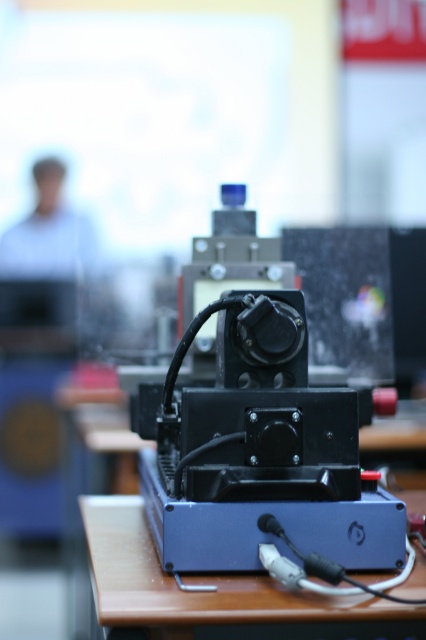
Is metallic black machine at center to the left of blue plastic table at center from the viewer's perspective?

In fact, metallic black machine at center is to the right of blue plastic table at center.

How distant is metallic black machine at center from blue plastic table at center?

They are 6.85 inches apart.

Identify the location of metallic black machine at center. (259, 449).

Where is `metallic black machine at center`? The height and width of the screenshot is (640, 426). metallic black machine at center is located at coordinates (259, 449).